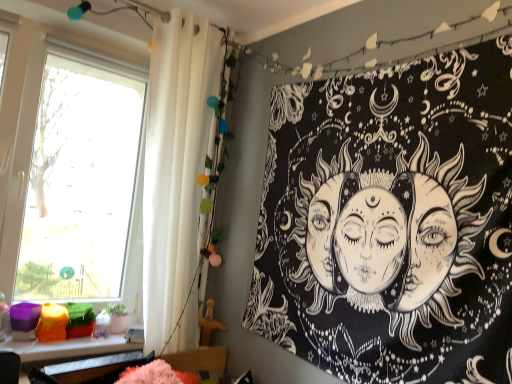
Question: Is plastic colorful objects at lower left thinner than white fabric shower curtain at left?

Choices:
 (A) yes
 (B) no

Answer: (B)

Question: From the image's perspective, is plastic colorful objects at lower left located beneath white fabric shower curtain at left?

Choices:
 (A) no
 (B) yes

Answer: (B)

Question: From a real-world perspective, is plastic colorful objects at lower left physically above white fabric shower curtain at left?

Choices:
 (A) no
 (B) yes

Answer: (A)

Question: Is plastic colorful objects at lower left in front of white fabric shower curtain at left?

Choices:
 (A) yes
 (B) no

Answer: (A)

Question: Can you confirm if plastic colorful objects at lower left is positioned to the right of white fabric shower curtain at left?

Choices:
 (A) yes
 (B) no

Answer: (B)

Question: Is plastic colorful objects at lower left inside the boundaries of transparent glass window at left, or outside?

Choices:
 (A) outside
 (B) inside

Answer: (A)

Question: Based on their sizes in the image, would you say plastic colorful objects at lower left is bigger or smaller than transparent glass window at left?

Choices:
 (A) big
 (B) small

Answer: (B)

Question: In the image, is plastic colorful objects at lower left on the left side or the right side of transparent glass window at left?

Choices:
 (A) left
 (B) right

Answer: (B)

Question: Does point (20, 382) appear closer or farther from the camera than point (31, 264)?

Choices:
 (A) closer
 (B) farther

Answer: (A)

Question: Based on their sizes in the image, would you say white fabric shower curtain at left is bigger or smaller than plastic colorful objects at lower left?

Choices:
 (A) big
 (B) small

Answer: (A)

Question: Looking at their shapes, would you say white fabric shower curtain at left is wider or thinner than plastic colorful objects at lower left?

Choices:
 (A) thin
 (B) wide

Answer: (A)

Question: In the image, is white fabric shower curtain at left on the left side or the right side of plastic colorful objects at lower left?

Choices:
 (A) right
 (B) left

Answer: (A)

Question: Is white fabric shower curtain at left inside the boundaries of plastic colorful objects at lower left, or outside?

Choices:
 (A) outside
 (B) inside

Answer: (A)

Question: From a real-world perspective, is plastic colorful objects at lower left above or below black paper tapestry at upper right?

Choices:
 (A) above
 (B) below

Answer: (B)

Question: Does point (78, 347) appear closer or farther from the camera than point (266, 311)?

Choices:
 (A) farther
 (B) closer

Answer: (B)